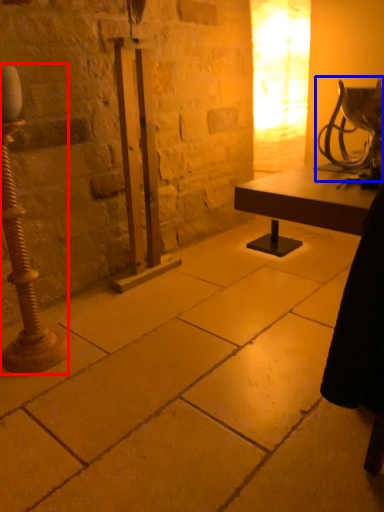
Question: Which of the following is the farthest to the observer, pillar (highlighted by a red box) or table lamp (highlighted by a blue box)?

Choices:
 (A) pillar
 (B) table lamp

Answer: (A)